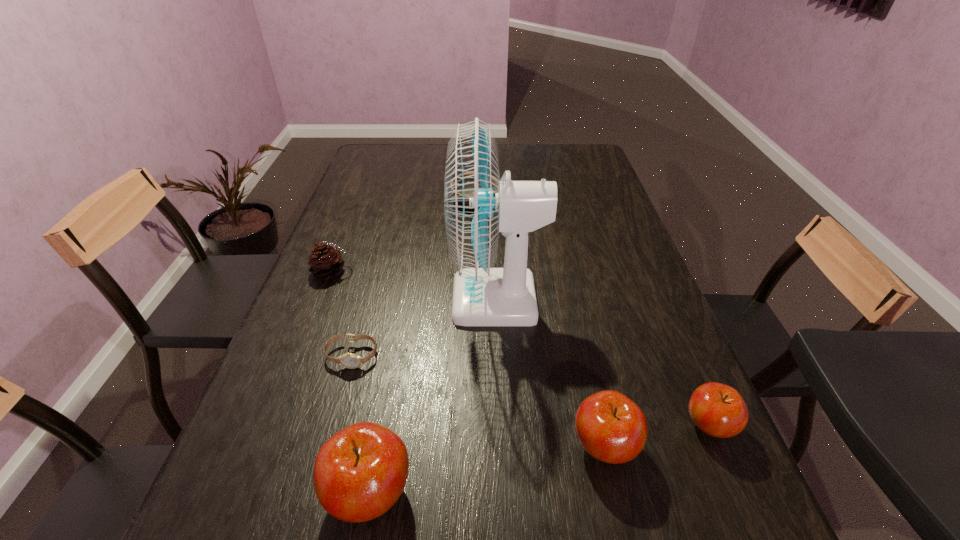
Please mark a free spot for a new apple to balance the arrangement. Please provide its 2D coordinates. Your answer should be formatted as a tuple, i.e. [(x, y)], where the tuple contains the x and y coordinates of a point satisfying the conditions above.

[(492, 468)]